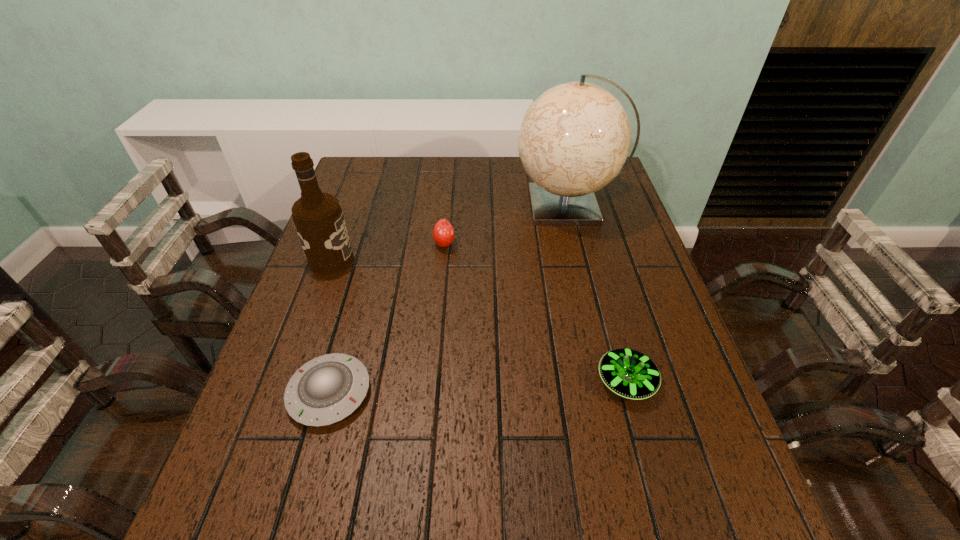
The width and height of the screenshot is (960, 540). I want to click on free location that satisfies the following two spatial constraints: 1. on the surface of the globe showing Europe and Africa; 2. on the left side of the taller saucer, so click(x=611, y=381).

Where is `vacant area that satisfies the following two spatial constraints: 1. on the back side of the second shortest object; 2. on the label of the alcohol`? The image size is (960, 540). vacant area that satisfies the following two spatial constraints: 1. on the back side of the second shortest object; 2. on the label of the alcohol is located at coordinates (592, 260).